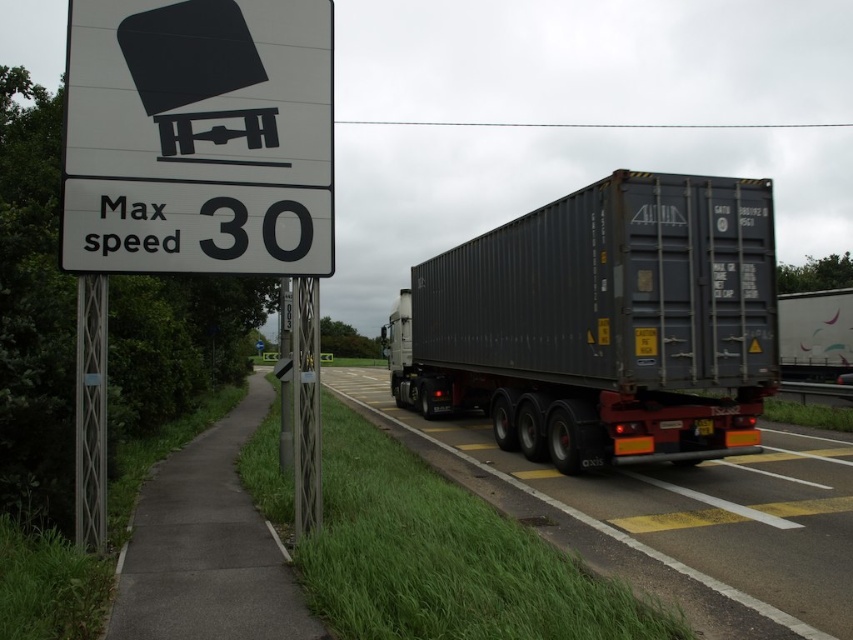
Which is above, matte black trailer truck at center or white paper sign at upper left?

white paper sign at upper left is higher up.

Is matte black trailer truck at center positioned at the back of white paper sign at upper left?

Yes, matte black trailer truck at center is behind white paper sign at upper left.

Locate an element on the screen. This screenshot has width=853, height=640. matte black trailer truck at center is located at coordinates (602, 323).

Does matte black trailer truck at center appear over metallic gray trailer at center?

Yes.

What are the coordinates of `matte black trailer truck at center` in the screenshot? It's located at (602, 323).

The image size is (853, 640). I want to click on matte black trailer truck at center, so click(x=602, y=323).

Is white paper sign at upper left positioned in front of metallic gray trailer at center?

No, white paper sign at upper left is behind metallic gray trailer at center.

Does white paper sign at upper left have a lesser height compared to metallic gray trailer at center?

No, white paper sign at upper left is not shorter than metallic gray trailer at center.

Between point (253, 202) and point (370, 401), which one is positioned in front?

Point (253, 202) is more forward.

Identify the location of white paper sign at upper left. (198, 136).